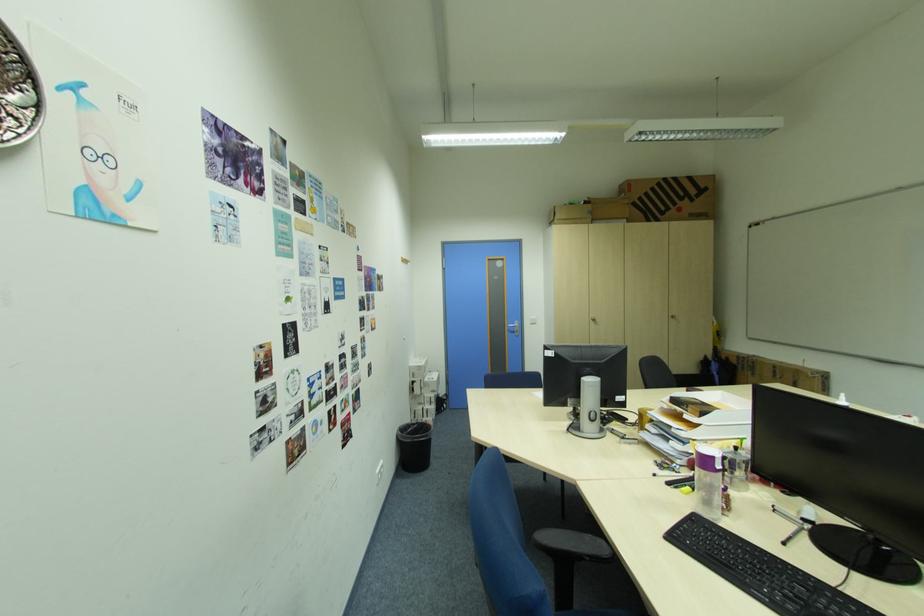
Where would you turn the silver door handle? Please return your answer as a coordinate pair (x, y).

(513, 326)